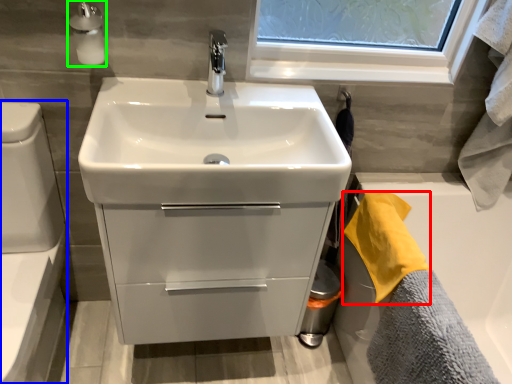
Question: Which object is the farthest from bath towel (highlighted by a red box)? Choose among these: toilet bowl (highlighted by a blue box) or soap dispenser (highlighted by a green box).

Choices:
 (A) toilet bowl
 (B) soap dispenser

Answer: (A)